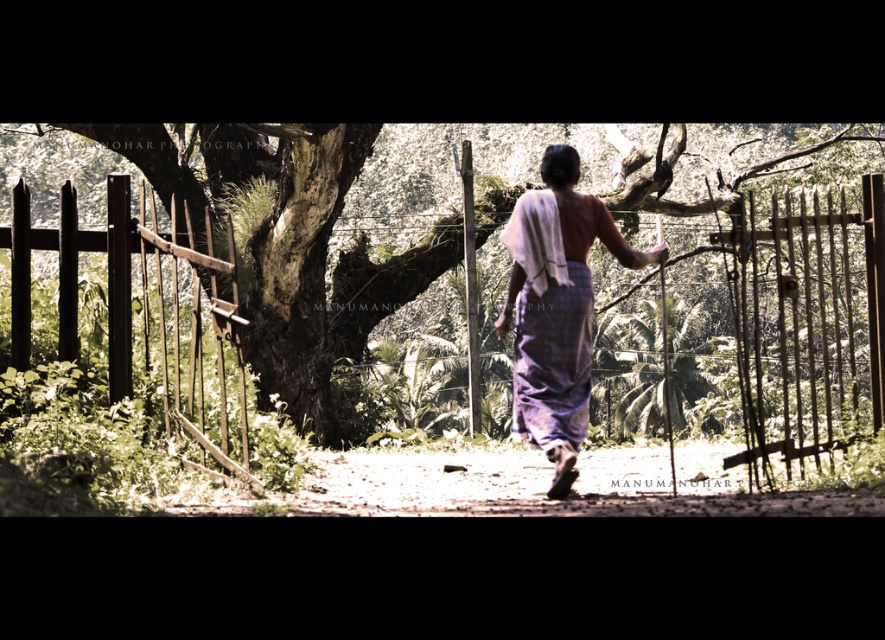
You are a hiker who needs to cross from the dirt ground at center to the dark brown wooden fence at left. Given that your average step length is 2.5 feet, how many steps will it take you to reach the fence?

The dirt ground at center is 7.59 feet from the dark brown wooden fence at left. Dividing the distance by your step length of 2.5 feet gives approximately 3.04 steps. Since you can only take whole steps, it will take you 4 steps to reach the fence.

You are standing at the position of the woman in the image and want to place a marker at both point (125, 285) and point (535, 438). Which point is closer to you?

Point (125, 285) is closer to you because it is further to the camera than point (535, 438).